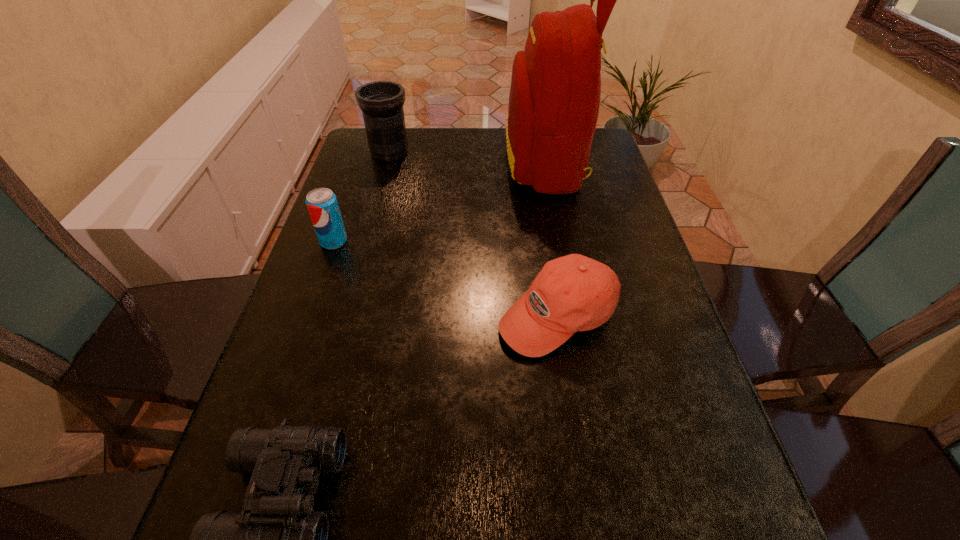
I want to click on backpack located at the far edge, so click(x=554, y=100).

Identify the location of telephoto lens present at the far edge. (381, 102).

You are a GUI agent. You are given a task and a screenshot of the screen. Output one action in this format:
    pyautogui.click(x=<x>, y=<y>)
    Task: Click on the telephoto lens that is at the left edge
    
    Given the screenshot: What is the action you would take?
    pyautogui.click(x=381, y=102)

Where is `soda can that is positioned at the left edge`? This screenshot has height=540, width=960. soda can that is positioned at the left edge is located at coordinates (322, 204).

Identify the location of backpack located in the right edge section of the desktop. (554, 100).

I want to click on baseball cap located in the right edge section of the desktop, so click(572, 293).

Find the location of a particular element. The image size is (960, 540). object located in the far left corner section of the desktop is located at coordinates (381, 102).

Image resolution: width=960 pixels, height=540 pixels. Find the location of `object located in the far right corner section of the desktop`. object located in the far right corner section of the desktop is located at coordinates (554, 100).

This screenshot has width=960, height=540. In the image, there is a desktop. Find the location of `free space at the far edge`. free space at the far edge is located at coordinates (438, 144).

You are a GUI agent. You are given a task and a screenshot of the screen. Output one action in this format:
    pyautogui.click(x=<x>, y=<y>)
    Task: Click on the free space at the left edge of the desktop
    Image resolution: width=960 pixels, height=540 pixels.
    Given the screenshot: What is the action you would take?
    pyautogui.click(x=349, y=238)